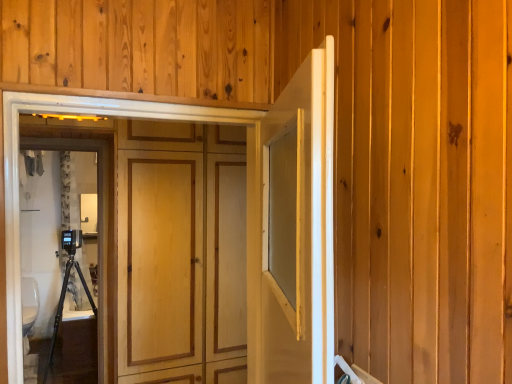
The height and width of the screenshot is (384, 512). What do you see at coordinates (300, 232) in the screenshot?
I see `wooden panel at center, which ranks as the second door in right-to-left order` at bounding box center [300, 232].

Find the location of a particular element. The image size is (512, 384). black plastic camera on the left is located at coordinates coord(98,221).

I want to click on white glossy toilet bowl at lower left, so click(29, 303).

Where is `wooden panel at center, which ranks as the second door in right-to-left order`? wooden panel at center, which ranks as the second door in right-to-left order is located at coordinates (300, 232).

Is wooden panel at center, placed as the first door when sorted from left to right, aimed at black plastic camera on the left?

Yes, wooden panel at center, placed as the first door when sorted from left to right, is aimed at black plastic camera on the left.

Find the location of `screen door on the left of wooden panel at center, which ranks as the second door in right-to-left order`. screen door on the left of wooden panel at center, which ranks as the second door in right-to-left order is located at coordinates (98, 221).

From the image's perspective, would you say wooden panel at center, placed as the first door when sorted from left to right, is shown under black plastic camera on the left?

No, from the image's perspective, wooden panel at center, placed as the first door when sorted from left to right, is not beneath black plastic camera on the left.

Which object is wider, black plastic camera on the left or wooden panel at center, which ranks as the second door in right-to-left order?

With larger width is black plastic camera on the left.

From a real-world perspective, is black plastic camera on the left above or below wooden panel at center, placed as the first door when sorted from left to right?

Clearly, from a real-world perspective, black plastic camera on the left is below wooden panel at center, placed as the first door when sorted from left to right.

From the picture: Can you see black plastic camera on the left touching wooden panel at center, placed as the first door when sorted from left to right?

No, black plastic camera on the left is not next to wooden panel at center, placed as the first door when sorted from left to right.

Considering the positions of points (101, 206) and (327, 115), is point (101, 206) farther from camera compared to point (327, 115)?

Yes, it is.

In terms of width, does white glossy toilet bowl at lower left look wider or thinner when compared to black plastic camera on the left?

Considering their sizes, white glossy toilet bowl at lower left looks broader than black plastic camera on the left.

Between white glossy toilet bowl at lower left and black plastic camera on the left, which one has smaller size?

Smaller between the two is white glossy toilet bowl at lower left.

From the image's perspective, between white glossy toilet bowl at lower left and black plastic camera on the left, which one is located above?

From the image's view, black plastic camera on the left is above.

Which object is wider, wooden panel at center, placed as the first door when sorted from left to right, or white glossy toilet bowl at lower left?

white glossy toilet bowl at lower left.

Is wooden panel at center, placed as the first door when sorted from left to right, in front of or behind white glossy toilet bowl at lower left in the image?

Visually, wooden panel at center, placed as the first door when sorted from left to right, is located in front of white glossy toilet bowl at lower left.

Is point (125, 109) more distant than point (37, 295)?

No, (125, 109) is in front of (37, 295).

Is white glossy door at center, positioned as the first door in right-to-left order, with wooden panel at center, which ranks as the second door in right-to-left order?

Yes, white glossy door at center, positioned as the first door in right-to-left order, is with wooden panel at center, which ranks as the second door in right-to-left order.

You are a GUI agent. You are given a task and a screenshot of the screen. Output one action in this format:
    pyautogui.click(x=<x>, y=<y>)
    Task: Click on the door positioned vertically above the wooden panel at center, which ranks as the second door in right-to-left order (from a real-world perspective)
    
    Given the screenshot: What is the action you would take?
    pyautogui.click(x=297, y=231)

Which is behind, point (317, 196) or point (284, 98)?

The point (284, 98) is farther.

Can wooden panel at center, placed as the first door when sorted from left to right, be found inside white glossy door at center, positioned as the first door in right-to-left order?

No, wooden panel at center, placed as the first door when sorted from left to right, is not a part of white glossy door at center, positioned as the first door in right-to-left order.

Looking at the image, does white glossy door at center, acting as the second door starting from the left, seem bigger or smaller compared to black plastic camera on the left?

Clearly, white glossy door at center, acting as the second door starting from the left, is smaller in size than black plastic camera on the left.

Is white glossy door at center, acting as the second door starting from the left, positioned beyond the bounds of black plastic camera on the left?

Yes, white glossy door at center, acting as the second door starting from the left, is outside of black plastic camera on the left.

Considering the sizes of objects white glossy door at center, acting as the second door starting from the left, and black plastic camera on the left in the image provided, who is taller, white glossy door at center, acting as the second door starting from the left, or black plastic camera on the left?

black plastic camera on the left is taller.

Does point (99, 174) come behind point (31, 288)?

That is False.

Is black plastic camera on the left positioned beyond the bounds of white glossy toilet bowl at lower left?

Yes, black plastic camera on the left is located beyond the bounds of white glossy toilet bowl at lower left.

Is black plastic camera on the left oriented away from white glossy toilet bowl at lower left?

Yes, black plastic camera on the left is positioned with its back facing white glossy toilet bowl at lower left.

Would you say black plastic camera on the left is a long distance from white glossy toilet bowl at lower left?

That's not correct — black plastic camera on the left is a little close to white glossy toilet bowl at lower left.

You are a GUI agent. You are given a task and a screenshot of the screen. Output one action in this format:
    pyautogui.click(x=<x>, y=<y>)
    Task: Click on the screen door lying below the wooden panel at center, placed as the first door when sorted from left to right (from the image's perspective)
    
    Given the screenshot: What is the action you would take?
    pyautogui.click(x=98, y=221)

Locate an element on the screen. This screenshot has height=384, width=512. the 1st door above the black plastic camera on the left (from the image's perspective) is located at coordinates (300, 232).

Looking at the image, which one is located closer to black plastic camera on the left, white glossy door at center, acting as the second door starting from the left, or wooden panel at center, placed as the first door when sorted from left to right?

The object closer to black plastic camera on the left is wooden panel at center, placed as the first door when sorted from left to right.

Estimate the real-world distances between objects in this image. Which object is further from white glossy door at center, acting as the second door starting from the left, wooden panel at center, which ranks as the second door in right-to-left order, or white glossy toilet bowl at lower left?

Based on the image, white glossy toilet bowl at lower left appears to be further to white glossy door at center, acting as the second door starting from the left.

Based on their spatial positions, is white glossy toilet bowl at lower left or wooden panel at center, placed as the first door when sorted from left to right, further from black plastic camera on the left?

wooden panel at center, placed as the first door when sorted from left to right.

Which object lies further to the anchor point white glossy door at center, acting as the second door starting from the left, white glossy toilet bowl at lower left or black plastic camera on the left?

Among the two, white glossy toilet bowl at lower left is located further to white glossy door at center, acting as the second door starting from the left.

When comparing their distances from wooden panel at center, placed as the first door when sorted from left to right, does white glossy toilet bowl at lower left or black plastic camera on the left seem further?

white glossy toilet bowl at lower left.

Looking at the image, which one is located further to white glossy door at center, positioned as the first door in right-to-left order, white glossy toilet bowl at lower left or wooden panel at center, which ranks as the second door in right-to-left order?

white glossy toilet bowl at lower left is positioned further to the anchor white glossy door at center, positioned as the first door in right-to-left order.

When comparing their distances from white glossy toilet bowl at lower left, does black plastic camera on the left or wooden panel at center, which ranks as the second door in right-to-left order, seem closer?

The object closer to white glossy toilet bowl at lower left is black plastic camera on the left.

From the image, which object appears to be farther from wooden panel at center, placed as the first door when sorted from left to right, white glossy door at center, positioned as the first door in right-to-left order, or white glossy toilet bowl at lower left?

white glossy toilet bowl at lower left lies further to wooden panel at center, placed as the first door when sorted from left to right, than the other object.

Where is `door between white glossy door at center, acting as the second door starting from the left, and black plastic camera on the left from front to back`? Image resolution: width=512 pixels, height=384 pixels. door between white glossy door at center, acting as the second door starting from the left, and black plastic camera on the left from front to back is located at coordinates (300, 232).

This screenshot has width=512, height=384. Find the location of `screen door between wooden panel at center, placed as the first door when sorted from left to right, and white glossy toilet bowl at lower left, along the z-axis`. screen door between wooden panel at center, placed as the first door when sorted from left to right, and white glossy toilet bowl at lower left, along the z-axis is located at coordinates (98, 221).

You are a GUI agent. You are given a task and a screenshot of the screen. Output one action in this format:
    pyautogui.click(x=<x>, y=<y>)
    Task: Click on the door between white glossy door at center, positioned as the first door in right-to-left order, and white glossy toilet bowl at lower left from front to back
    This screenshot has height=384, width=512.
    Given the screenshot: What is the action you would take?
    pyautogui.click(x=300, y=232)

I want to click on screen door between white glossy door at center, acting as the second door starting from the left, and white glossy toilet bowl at lower left, along the z-axis, so click(98, 221).